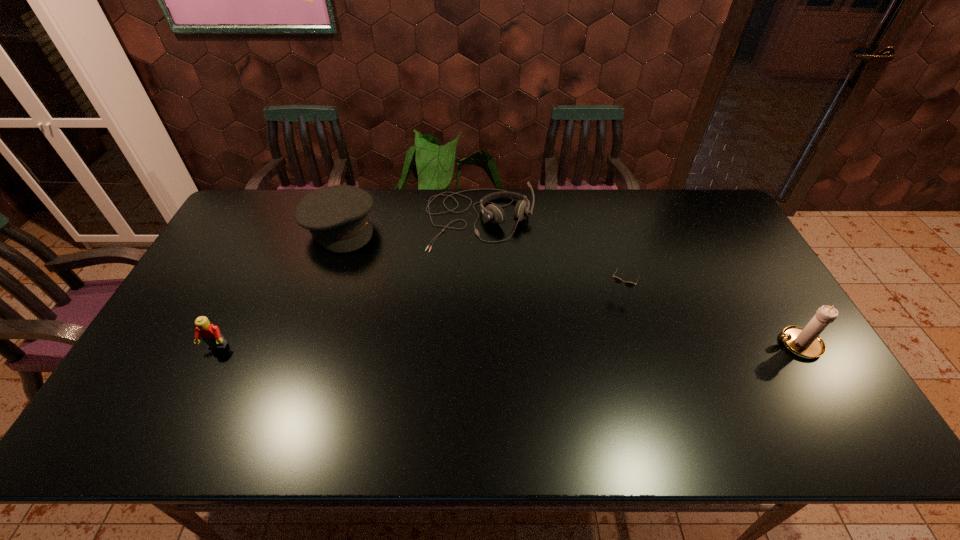
In order to click on vacant space located on the handle side of the candle holder in this screenshot , I will do `click(732, 344)`.

Find the location of a particular element. The image size is (960, 540). free location located in front of the lenses of the third farthest object is located at coordinates (590, 346).

At what (x,y) coordinates should I click in order to perform the action: click on free space located in front of the lenses of the third farthest object. Please return your answer as a coordinate pair (x, y). The width and height of the screenshot is (960, 540). Looking at the image, I should click on (598, 330).

This screenshot has width=960, height=540. What are the coordinates of `free spot located in front of the lenses of the third farthest object` in the screenshot? It's located at (602, 320).

Where is `vacant space located 0.180m on the front-facing side of the beret`? The image size is (960, 540). vacant space located 0.180m on the front-facing side of the beret is located at coordinates (379, 281).

Identify the location of free space located 0.350m on the front-facing side of the beret. The width and height of the screenshot is (960, 540). click(x=406, y=318).

Where is `vacant space located 0.100m on the front-facing side of the beret`? This screenshot has height=540, width=960. vacant space located 0.100m on the front-facing side of the beret is located at coordinates (369, 266).

The width and height of the screenshot is (960, 540). In order to click on vacant region located 0.210m on the outer surface of the third object from right to left in this screenshot , I will do `click(501, 301)`.

Identify the location of vacant position located on the outer surface of the third object from right to left. (512, 343).

You are a GUI agent. You are given a task and a screenshot of the screen. Output one action in this format:
    pyautogui.click(x=<x>, y=<y>)
    Task: Click on the free space located 0.270m on the outer surface of the third object from right to left
    Image resolution: width=960 pixels, height=540 pixels.
    Given the screenshot: What is the action you would take?
    pyautogui.click(x=505, y=318)